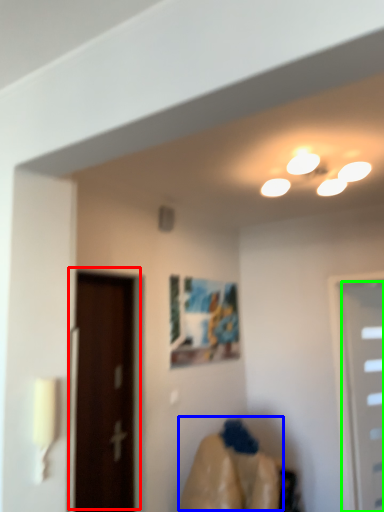
Question: Considering the real-world distances, which object is farthest from door (highlighted by a red box)? woman (highlighted by a blue box) or door (highlighted by a green box)?

Choices:
 (A) woman
 (B) door

Answer: (B)